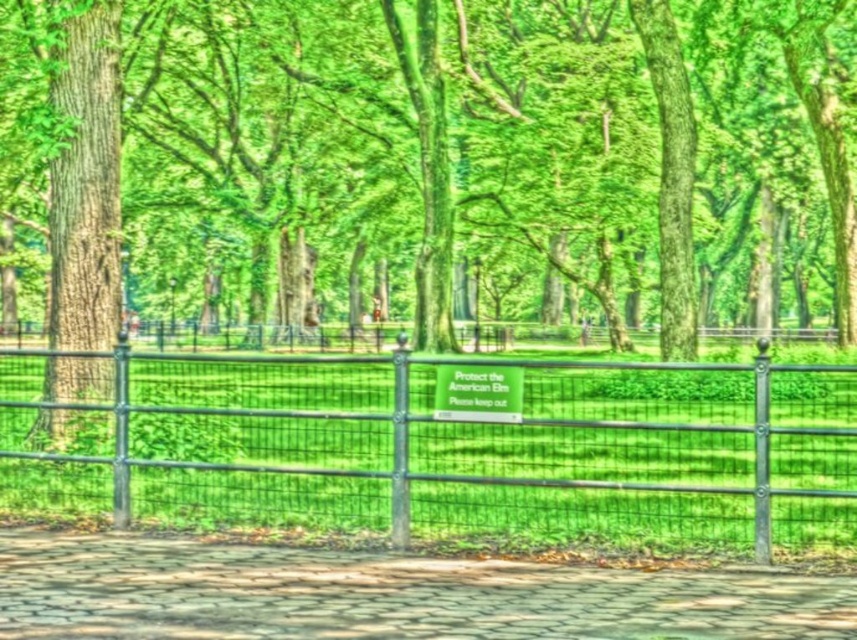
You are a park visitor who wants to walk on the paved stone path at lower center. Can you step onto it without crossing the green wire mesh fence at center?

The paved stone path at lower center is behind the green wire mesh fence at center, so you cannot step onto it without crossing the fence.

You are a park visitor who wants to walk along the paved stone path at lower center. However, you notice the green wire mesh fence at center blocking your way. Can you walk past the fence to continue on the path?

The green wire mesh fence at center is to the right of the paved stone path at lower center, so the fence is blocking the path. You cannot walk past the fence to continue on the paved stone path at lower center.

You are a park visitor who wants to walk on the paved stone path at lower center. Is the green leafy tree at center blocking your path?

The green leafy tree at center is above the paved stone path at lower center, so it is not blocking the path.